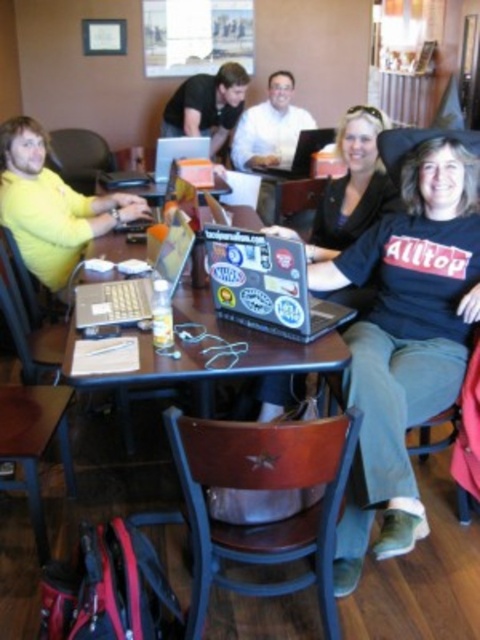
Question: Is sticker-covered laptop at center wider than matte black laptop at center?

Choices:
 (A) yes
 (B) no

Answer: (A)

Question: Which object appears closest to the camera in this image?

Choices:
 (A) sticker-covered laptop at center
 (B) white glossy shirt at center
 (C) shiny silver laptop at center
 (D) matte black laptop at center

Answer: (A)

Question: Which point appears farthest from the camera in this image?

Choices:
 (A) (169, 280)
 (B) (31, 141)
 (C) (263, 172)
 (D) (168, 108)

Answer: (D)

Question: Is yellow matte shirt at left below white glossy shirt at center?

Choices:
 (A) no
 (B) yes

Answer: (B)

Question: Which point appears closest to the camera in this image?

Choices:
 (A) (249, 77)
 (B) (2, 182)
 (C) (282, 109)

Answer: (B)

Question: From the image, what is the correct spatial relationship of sticker-covered laptop at center in relation to matte black laptop at center?

Choices:
 (A) right
 (B) left

Answer: (A)